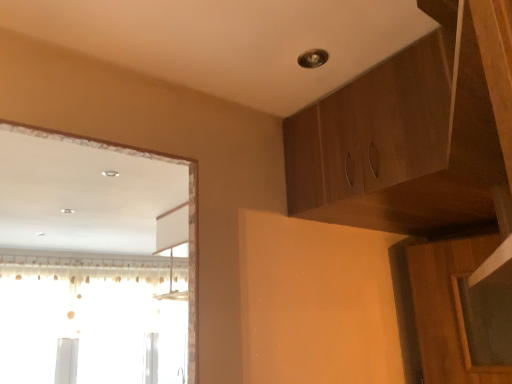
Describe the element at coordinates (93, 319) in the screenshot. I see `translucent fabric curtain at left` at that location.

In order to click on translucent fabric curtain at left in this screenshot , I will do `click(93, 319)`.

This screenshot has width=512, height=384. In order to click on wooden cabinet at upper right in this screenshot , I will do `click(406, 140)`.

What do you see at coordinates (406, 140) in the screenshot? I see `wooden cabinet at upper right` at bounding box center [406, 140].

Find the location of a particular element. translucent fabric curtain at left is located at coordinates (93, 319).

Between wooden cabinet at upper right and translucent fabric curtain at left, which one appears on the left side from the viewer's perspective?

translucent fabric curtain at left.

In the scene shown: Considering the positions of objects wooden cabinet at upper right and translucent fabric curtain at left in the image provided, who is in front, wooden cabinet at upper right or translucent fabric curtain at left?

wooden cabinet at upper right.

Is point (406, 97) behind point (5, 356)?

No, it is not.

From the image's perspective, is wooden cabinet at upper right located beneath translucent fabric curtain at left?

No, from the image's perspective, wooden cabinet at upper right is not below translucent fabric curtain at left.

From a real-world perspective, who is located higher, wooden cabinet at upper right or translucent fabric curtain at left?

From a 3D spatial view, wooden cabinet at upper right is above.

Considering the sizes of objects wooden cabinet at upper right and translucent fabric curtain at left in the image provided, who is wider, wooden cabinet at upper right or translucent fabric curtain at left?

Wider between the two is wooden cabinet at upper right.

In terms of height, does wooden cabinet at upper right look taller or shorter compared to translucent fabric curtain at left?

Considering their sizes, wooden cabinet at upper right has less height than translucent fabric curtain at left.

Who is smaller, wooden cabinet at upper right or translucent fabric curtain at left?

wooden cabinet at upper right.

Is wooden cabinet at upper right outside of translucent fabric curtain at left?

Yes, wooden cabinet at upper right is outside of translucent fabric curtain at left.

Is wooden cabinet at upper right far away from translucent fabric curtain at left?

Yes, wooden cabinet at upper right and translucent fabric curtain at left are quite far apart.

Is wooden cabinet at upper right oriented towards translucent fabric curtain at left?

No, wooden cabinet at upper right is not turned towards translucent fabric curtain at left.

What's the angular difference between wooden cabinet at upper right and translucent fabric curtain at left's facing directions?

The facing directions of wooden cabinet at upper right and translucent fabric curtain at left are 90.5 degrees apart.

How much distance is there between wooden cabinet at upper right and translucent fabric curtain at left?

wooden cabinet at upper right is 3.81 meters away from translucent fabric curtain at left.

The image size is (512, 384). Find the location of `window that is behind the wooden cabinet at upper right`. window that is behind the wooden cabinet at upper right is located at coordinates (93, 319).

Looking at this image, considering the positions of objects translucent fabric curtain at left and wooden cabinet at upper right in the image provided, who is more to the left, translucent fabric curtain at left or wooden cabinet at upper right?

translucent fabric curtain at left.

Does translucent fabric curtain at left lie behind wooden cabinet at upper right?

Yes, it is.

Considering the positions of point (150, 329) and point (358, 130), is point (150, 329) closer or farther from the camera than point (358, 130)?

Point (150, 329) appears to be farther away from the viewer than point (358, 130).

From the image's perspective, is translucent fabric curtain at left above or below wooden cabinet at upper right?

From the image's perspective, translucent fabric curtain at left appears below wooden cabinet at upper right.

From a real-world perspective, between translucent fabric curtain at left and wooden cabinet at upper right, who is vertically higher?

wooden cabinet at upper right is physically above.

Considering the sizes of objects translucent fabric curtain at left and wooden cabinet at upper right in the image provided, who is thinner, translucent fabric curtain at left or wooden cabinet at upper right?

With smaller width is translucent fabric curtain at left.

Is translucent fabric curtain at left shorter than wooden cabinet at upper right?

In fact, translucent fabric curtain at left may be taller than wooden cabinet at upper right.

Does translucent fabric curtain at left have a larger size compared to wooden cabinet at upper right?

Yes.

Consider the image. Is translucent fabric curtain at left not inside wooden cabinet at upper right?

Indeed, translucent fabric curtain at left is completely outside wooden cabinet at upper right.

Are translucent fabric curtain at left and wooden cabinet at upper right far apart?

Yes, translucent fabric curtain at left and wooden cabinet at upper right are located far from each other.

Is translucent fabric curtain at left oriented away from wooden cabinet at upper right?

translucent fabric curtain at left is not turned away from wooden cabinet at upper right.

How far apart are translucent fabric curtain at left and wooden cabinet at upper right?

12.49 feet.

The image size is (512, 384). Identify the location of window that is on the left side of wooden cabinet at upper right. (93, 319).

Where is `cabinetry in front of the translucent fabric curtain at left`? The image size is (512, 384). cabinetry in front of the translucent fabric curtain at left is located at coordinates (406, 140).

Locate an element on the screen. The height and width of the screenshot is (384, 512). window below the wooden cabinet at upper right (from a real-world perspective) is located at coordinates (93, 319).